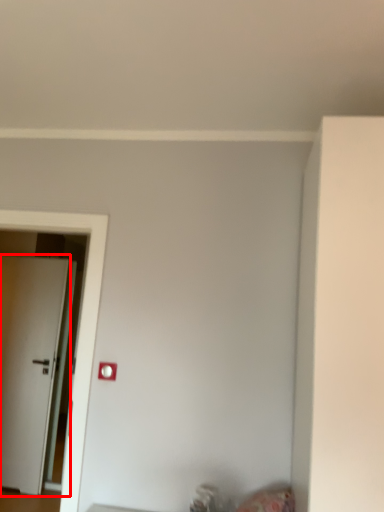
Question: Where is door (annotated by the red box) located in relation to light switch in the image?

Choices:
 (A) left
 (B) right

Answer: (A)